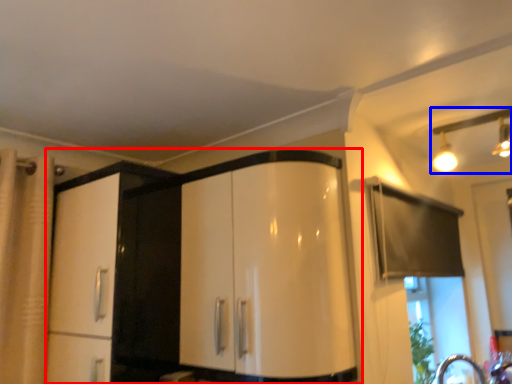
Question: Which of the following is the farthest to the observer, cabinetry (highlighted by a red box) or light fixture (highlighted by a blue box)?

Choices:
 (A) cabinetry
 (B) light fixture

Answer: (B)